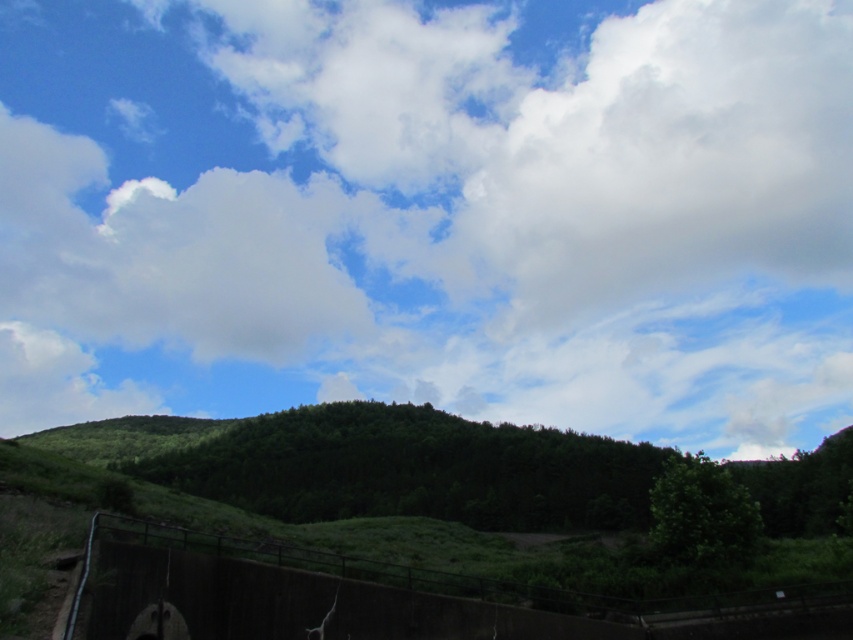
Question: Can you confirm if white fluffy cloud at upper center is smaller than metallic gray fence at lower left?

Choices:
 (A) yes
 (B) no

Answer: (B)

Question: Considering the relative positions of white fluffy cloud at upper center and metallic gray fence at lower left in the image provided, where is white fluffy cloud at upper center located with respect to metallic gray fence at lower left?

Choices:
 (A) left
 (B) right

Answer: (A)

Question: Which of the following is the farthest from the observer?

Choices:
 (A) (508, 616)
 (B) (387, 324)

Answer: (B)

Question: Does white fluffy cloud at upper center appear on the left side of metallic gray fence at lower left?

Choices:
 (A) no
 (B) yes

Answer: (B)

Question: Which point is closer to the camera taking this photo?

Choices:
 (A) (218, 627)
 (B) (729, 12)

Answer: (A)

Question: Among these points, which one is farthest from the camera?

Choices:
 (A) (225, 588)
 (B) (15, 76)

Answer: (B)